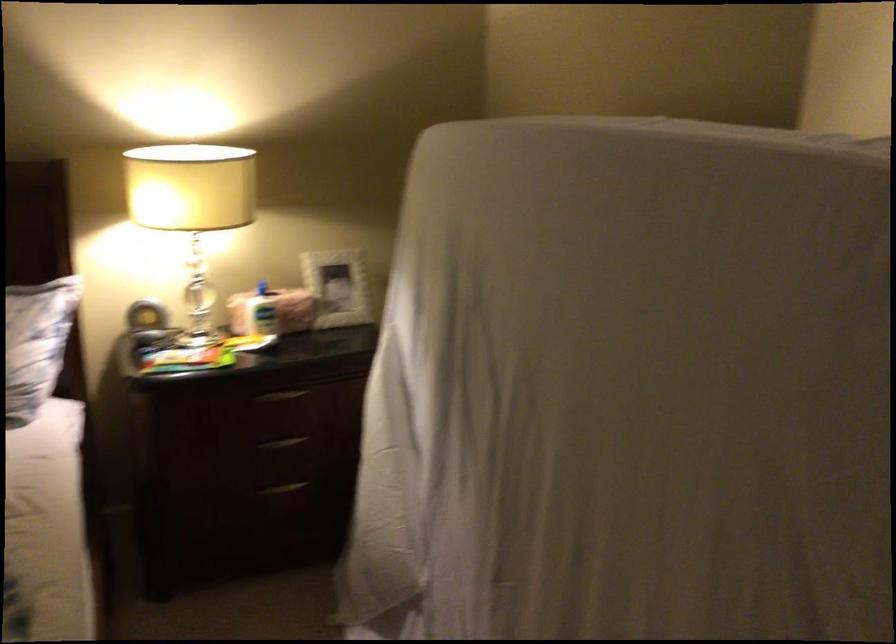
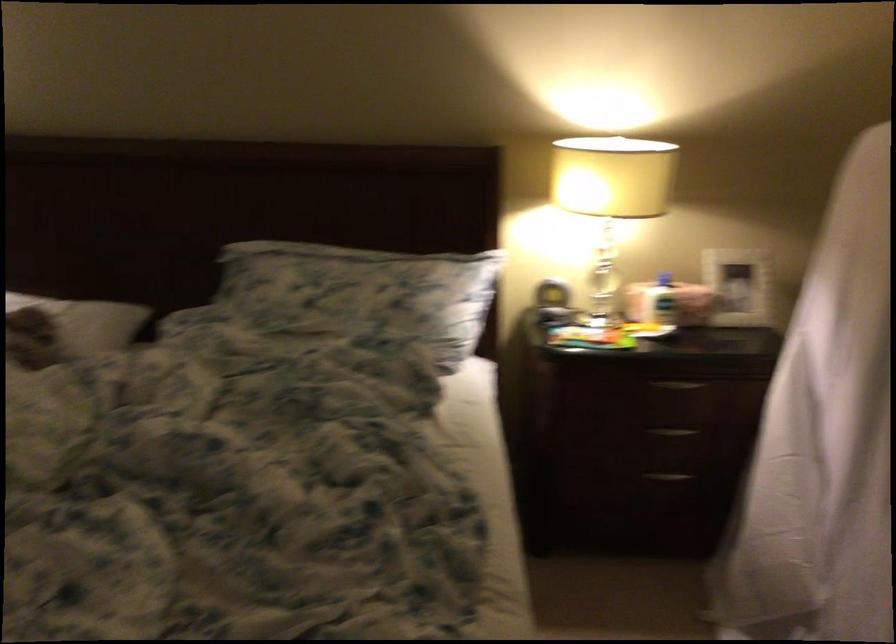
The point at (285,491) is marked in the first image. Where is the corresponding point in the second image?

(668, 476)